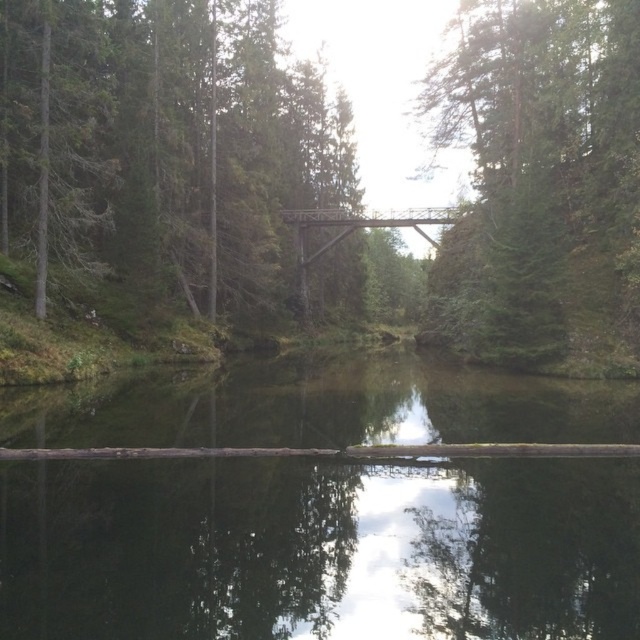
You are a hiker carrying a large backpack and need to cross the water. The brown wood bridge at center and the rusty metal bridge at center are both options. Which bridge can accommodate your backpack without bending or breaking?

The brown wood bridge at center is wider than the rusty metal bridge at center, so it can accommodate your backpack without bending or breaking.